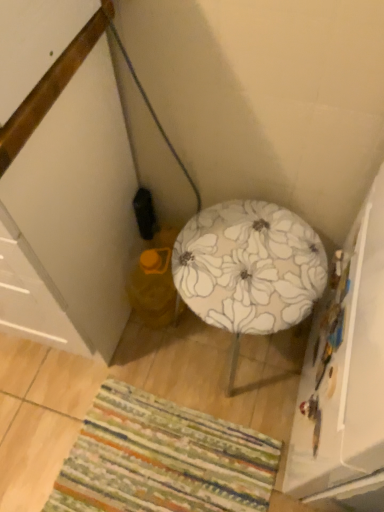
What do you see at coordinates (249, 268) in the screenshot?
I see `floral fabric stool at center` at bounding box center [249, 268].

Identify the location of multicolored woven mat at lower center. (163, 459).

What do you see at coordinates (70, 219) in the screenshot?
I see `white glossy cabinet at lower left` at bounding box center [70, 219].

What are the coordinates of `floral fabric stool at center` in the screenshot? It's located at (249, 268).

What's the angular difference between yellow fabric bean bag chair at lower left and multicolored woven mat at lower center's facing directions?

The facing directions of yellow fabric bean bag chair at lower left and multicolored woven mat at lower center are 92.3 degrees apart.

The height and width of the screenshot is (512, 384). In the image, there is a yellow fabric bean bag chair at lower left. What are the coordinates of `mat below it (from the image's perspective)` in the screenshot? It's located at (163, 459).

Is the depth of yellow fabric bean bag chair at lower left greater than that of multicolored woven mat at lower center?

Yes, the depth of yellow fabric bean bag chair at lower left is greater than that of multicolored woven mat at lower center.

From the image's perspective, does yellow fabric bean bag chair at lower left appear higher than multicolored woven mat at lower center?

Correct, yellow fabric bean bag chair at lower left appears higher than multicolored woven mat at lower center in the image.

Is floral fabric stool at center spatially inside multicolored woven mat at lower center, or outside of it?

The correct answer is: outside.

Which object is further away from the camera taking this photo, floral fabric stool at center or multicolored woven mat at lower center?

multicolored woven mat at lower center is more distant.

How different are the orientations of floral fabric stool at center and multicolored woven mat at lower center in degrees?

The facing directions of floral fabric stool at center and multicolored woven mat at lower center are 90 degrees apart.

Image resolution: width=384 pixels, height=512 pixels. In order to click on cabinetry above the yellow fabric bean bag chair at lower left (from the image's perspective) in this screenshot , I will do `click(70, 219)`.

Considering the relative sizes of white glossy cabinet at lower left and yellow fabric bean bag chair at lower left in the image provided, is white glossy cabinet at lower left smaller than yellow fabric bean bag chair at lower left?

No, white glossy cabinet at lower left is not smaller than yellow fabric bean bag chair at lower left.

Is white glossy cabinet at lower left shorter than yellow fabric bean bag chair at lower left?

No, white glossy cabinet at lower left is not shorter than yellow fabric bean bag chair at lower left.

Is there a large distance between white glossy cabinet at lower left and yellow fabric bean bag chair at lower left?

Actually, white glossy cabinet at lower left and yellow fabric bean bag chair at lower left are a little close together.

Based on their sizes in the image, would you say white glossy cabinet at lower left is bigger or smaller than floral fabric stool at center?

Considering their sizes, white glossy cabinet at lower left takes up more space than floral fabric stool at center.

In the image, is white glossy cabinet at lower left on the left side or the right side of floral fabric stool at center?

In the image, white glossy cabinet at lower left appears on the left side of floral fabric stool at center.

Is white glossy cabinet at lower left surrounding floral fabric stool at center?

No, floral fabric stool at center is located outside of white glossy cabinet at lower left.

From the image's perspective, would you say white glossy cabinet at lower left is positioned over floral fabric stool at center?

Yes.

How much distance is there between floral fabric stool at center and white glossy cabinet at lower left?

They are 13.81 inches apart.

Who is bigger, floral fabric stool at center or white glossy cabinet at lower left?

Bigger between the two is white glossy cabinet at lower left.

In the scene shown: Is floral fabric stool at center with white glossy cabinet at lower left?

No, floral fabric stool at center is not next to white glossy cabinet at lower left.

Which object is closer to the camera, floral fabric stool at center or white glossy cabinet at lower left?

Positioned in front is white glossy cabinet at lower left.

Would you say multicolored woven mat at lower center is a long distance from yellow fabric bean bag chair at lower left?

They are positioned close to each other.

Who is taller, multicolored woven mat at lower center or yellow fabric bean bag chair at lower left?

yellow fabric bean bag chair at lower left is taller.

Is point (141, 468) farther from viewer compared to point (165, 306)?

No, it is not.

Is multicolored woven mat at lower center further to camera compared to yellow fabric bean bag chair at lower left?

No.

Which of these two, multicolored woven mat at lower center or white glossy cabinet at lower left, stands taller?

With more height is white glossy cabinet at lower left.

Which point is more distant from viewer, (225,501) or (35,196)?

The point (225,501) is farther.

In the scene shown: Which is correct: multicolored woven mat at lower center is inside white glossy cabinet at lower left, or outside of it?

The correct answer is: outside.

I want to click on mat below the yellow fabric bean bag chair at lower left (from the image's perspective), so click(x=163, y=459).

Locate an element on the screen. The image size is (384, 512). mat below the floral fabric stool at center (from a real-world perspective) is located at coordinates (163, 459).

When comparing their distances from yellow fabric bean bag chair at lower left, does multicolored woven mat at lower center or white glossy cabinet at lower left seem closer?

Among the two, white glossy cabinet at lower left is located nearer to yellow fabric bean bag chair at lower left.

Looking at the image, which one is located further to floral fabric stool at center, white glossy cabinet at lower left or yellow fabric bean bag chair at lower left?

white glossy cabinet at lower left lies further to floral fabric stool at center than the other object.

From the image, which object appears to be farther from multicolored woven mat at lower center, floral fabric stool at center or yellow fabric bean bag chair at lower left?

floral fabric stool at center is further to multicolored woven mat at lower center.

From the image, which object appears to be nearer to multicolored woven mat at lower center, white glossy cabinet at lower left or floral fabric stool at center?

Based on the image, white glossy cabinet at lower left appears to be nearer to multicolored woven mat at lower center.

When comparing their distances from yellow fabric bean bag chair at lower left, does multicolored woven mat at lower center or floral fabric stool at center seem closer?

The object closer to yellow fabric bean bag chair at lower left is floral fabric stool at center.

Which object lies further to the anchor point multicolored woven mat at lower center, yellow fabric bean bag chair at lower left or white glossy cabinet at lower left?

The object further to multicolored woven mat at lower center is white glossy cabinet at lower left.

When comparing their distances from multicolored woven mat at lower center, does white glossy cabinet at lower left or yellow fabric bean bag chair at lower left seem closer?

yellow fabric bean bag chair at lower left is positioned closer to the anchor multicolored woven mat at lower center.

Which object lies nearer to the anchor point floral fabric stool at center, yellow fabric bean bag chair at lower left or white glossy cabinet at lower left?

Based on the image, yellow fabric bean bag chair at lower left appears to be nearer to floral fabric stool at center.

Locate an element on the screen. furniture between yellow fabric bean bag chair at lower left and multicolored woven mat at lower center in the up-down direction is located at coordinates (249, 268).

Locate an element on the screen. The image size is (384, 512). furniture between white glossy cabinet at lower left and multicolored woven mat at lower center vertically is located at coordinates (249, 268).

Find the location of a particular element. This screenshot has width=384, height=512. bean bag chair between white glossy cabinet at lower left and multicolored woven mat at lower center in the vertical direction is located at coordinates (154, 288).

Where is `bean bag chair between white glossy cabinet at lower left and floral fabric stool at center in the horizontal direction`? The height and width of the screenshot is (512, 384). bean bag chair between white glossy cabinet at lower left and floral fabric stool at center in the horizontal direction is located at coordinates (154, 288).